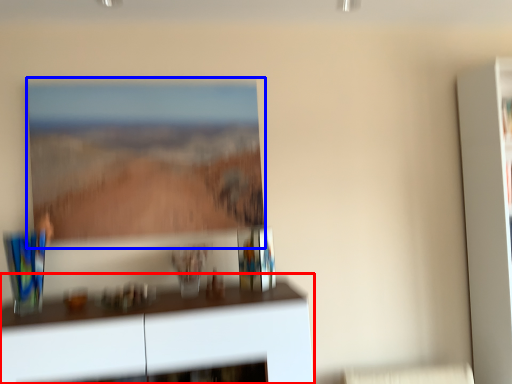
Question: Which object is further to the camera taking this photo, furniture (highlighted by a red box) or picture frame (highlighted by a blue box)?

Choices:
 (A) furniture
 (B) picture frame

Answer: (B)